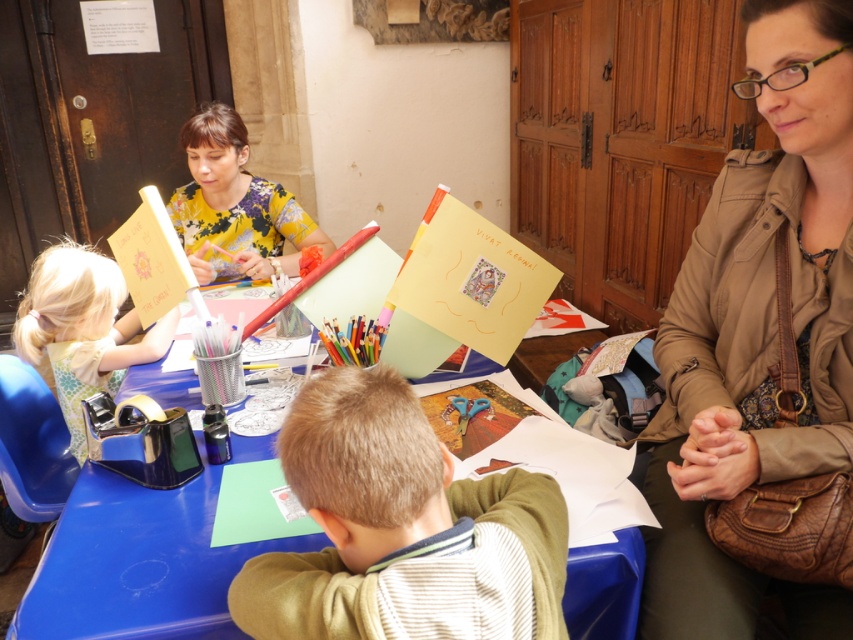
Based on the photo, is light brown hair at center to the left of blue plastic table at center from the viewer's perspective?

No, light brown hair at center is not to the left of blue plastic table at center.

Is point (508, 620) less distant than point (622, 625)?

Yes, point (508, 620) is in front of point (622, 625).

Does point (254, 612) come closer to viewer compared to point (247, 442)?

Yes, point (254, 612) is closer to viewer.

Locate an element on the screen. light brown hair at center is located at coordinates (401, 529).

Who is lower down, brown leather jacket at upper right or matte yellow card at left?

matte yellow card at left

The height and width of the screenshot is (640, 853). I want to click on brown leather jacket at upper right, so click(x=756, y=323).

Locate an element on the screen. brown leather jacket at upper right is located at coordinates (756, 323).

Can you confirm if light brown hair at center is positioned to the left of matte yellow card at left?

No, light brown hair at center is not to the left of matte yellow card at left.

Between point (308, 468) and point (61, 330), which one is positioned behind?

The point (61, 330) is more distant.

Identify the location of light brown hair at center. This screenshot has height=640, width=853. (401, 529).